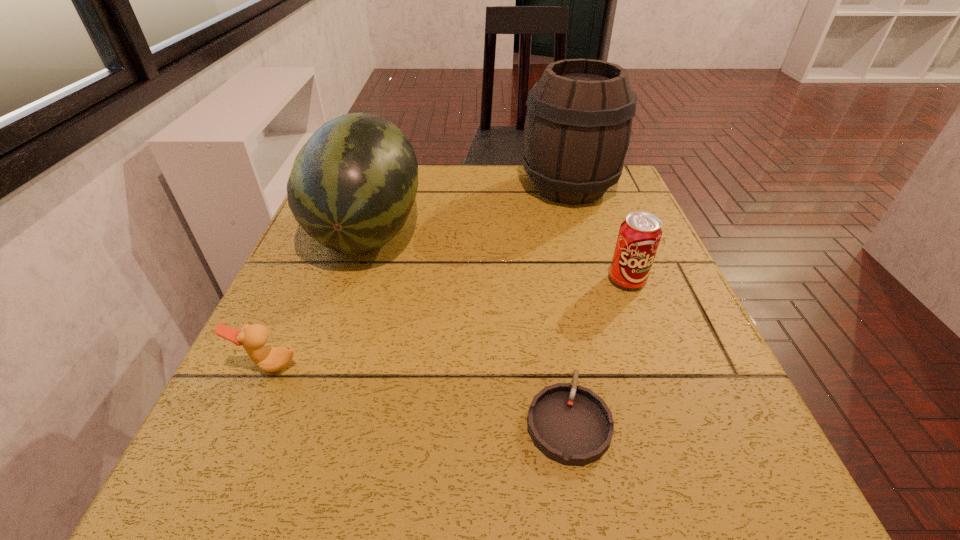
Find the location of a particular element. object present at the far right corner is located at coordinates (578, 124).

The image size is (960, 540). In order to click on free space at the far edge of the desktop in this screenshot , I will do `click(435, 198)`.

Find the location of `blank area at the near edge`. blank area at the near edge is located at coordinates (482, 470).

The height and width of the screenshot is (540, 960). What are the coordinates of `free space at the left edge of the desktop` in the screenshot? It's located at click(x=314, y=375).

At what (x,y) coordinates should I click in order to perform the action: click on free space at the right edge of the desktop. Please return your answer as a coordinate pair (x, y). This screenshot has height=540, width=960. Looking at the image, I should click on (659, 290).

The image size is (960, 540). Identify the location of vacant point at the far right corner. (620, 180).

Image resolution: width=960 pixels, height=540 pixels. Identify the location of vacant space in between the soda and the wine bucket. (598, 234).

Find the location of a particular element. Image resolution: width=960 pixels, height=540 pixels. vacant point located between the duck and the shortest object is located at coordinates (419, 393).

This screenshot has height=540, width=960. What are the coordinates of `free space that is in between the duck and the nearest object` in the screenshot? It's located at (419, 393).

The image size is (960, 540). I want to click on free space between the soda and the fourth shortest object, so click(497, 255).